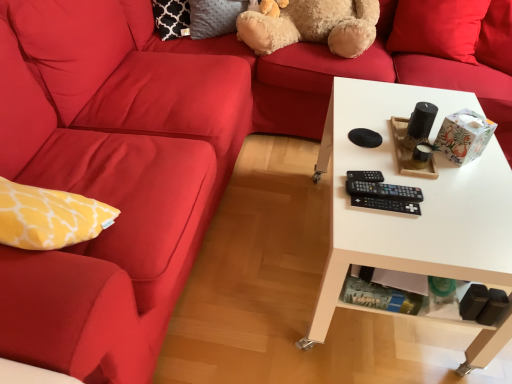
Where is `unoccupied space behind black plastic remote at center, which ranks as the 2th control in back-to-front order`? The image size is (512, 384). unoccupied space behind black plastic remote at center, which ranks as the 2th control in back-to-front order is located at coordinates (377, 155).